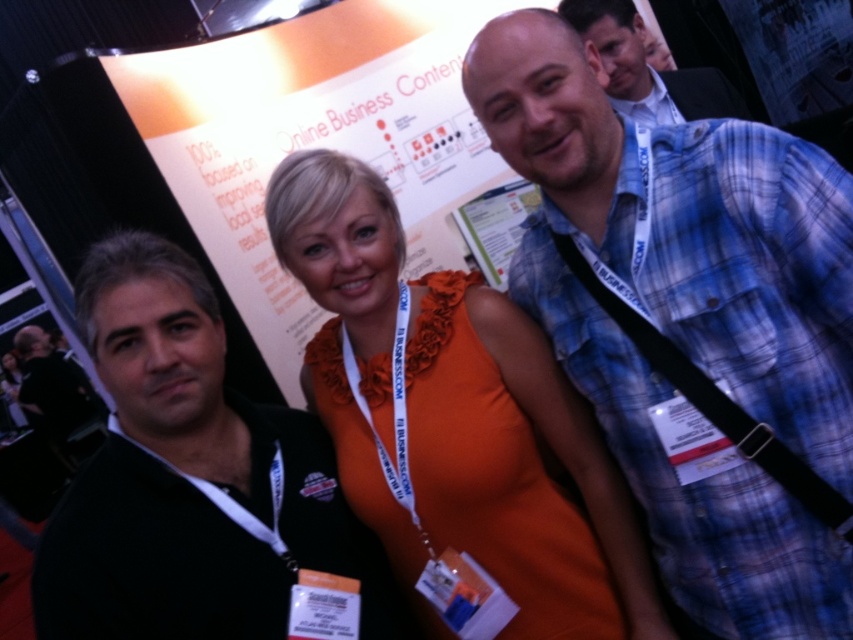
Who is shorter, orange satin dress at center or blue plaid shirt at upper right?

Standing shorter between the two is blue plaid shirt at upper right.

Who is higher up, orange satin dress at center or blue plaid shirt at upper right?

blue plaid shirt at upper right is higher up.

Which is behind, point (426, 404) or point (593, 10)?

The point (593, 10) is more distant.

At what (x,y) coordinates should I click in order to perform the action: click on orange satin dress at center. Please return your answer as a coordinate pair (x, y). The width and height of the screenshot is (853, 640). Looking at the image, I should click on (453, 420).

Does point (270, 184) come closer to viewer compared to point (781, 456)?

No, it is behind (781, 456).

Is point (428, 636) behind point (637, 330)?

Yes, point (428, 636) is behind point (637, 330).

Identify the location of orange satin dress at center. (453, 420).

Is point (641, 323) positioned behind point (664, 92)?

That is False.

Is black fabric lanyard at right to the left of blue plaid shirt at upper right from the viewer's perspective?

Correct, you'll find black fabric lanyard at right to the left of blue plaid shirt at upper right.

Which is in front, point (735, 417) or point (631, 112)?

Positioned in front is point (735, 417).

This screenshot has height=640, width=853. What are the coordinates of `black fabric lanyard at right` in the screenshot? It's located at (714, 401).